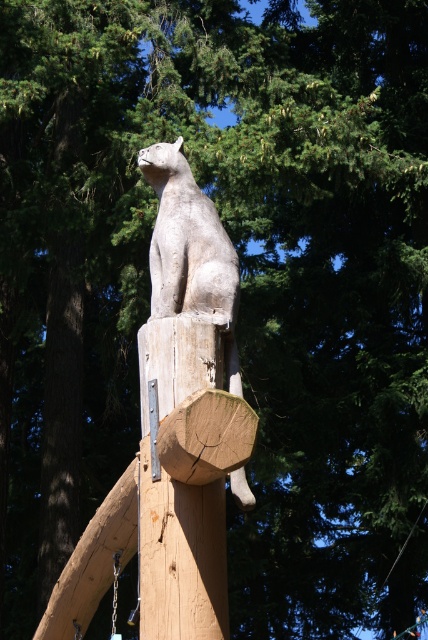
Is gray wood cat at center taller than gray stone cat at center?

Yes.

Image resolution: width=428 pixels, height=640 pixels. What are the coordinates of `gray wood cat at center` in the screenshot? It's located at (190, 252).

Where is `gray wood cat at center`? This screenshot has width=428, height=640. gray wood cat at center is located at coordinates (190, 252).

Which is in front, point (169, 289) or point (38, 602)?

Point (169, 289)

Between gray wood cat at center and dark brown wood at left, which one has more height?

gray wood cat at center is taller.

In order to click on gray wood cat at center in this screenshot , I will do `click(190, 252)`.

Measure the distance between natural wood log at center and dark brown wood at left.

91.42 feet

Looking at this image, who is higher up, natural wood log at center or dark brown wood at left?

natural wood log at center

What do you see at coordinates (180, 493) in the screenshot?
I see `natural wood log at center` at bounding box center [180, 493].

This screenshot has width=428, height=640. Identify the location of natural wood log at center. (180, 493).